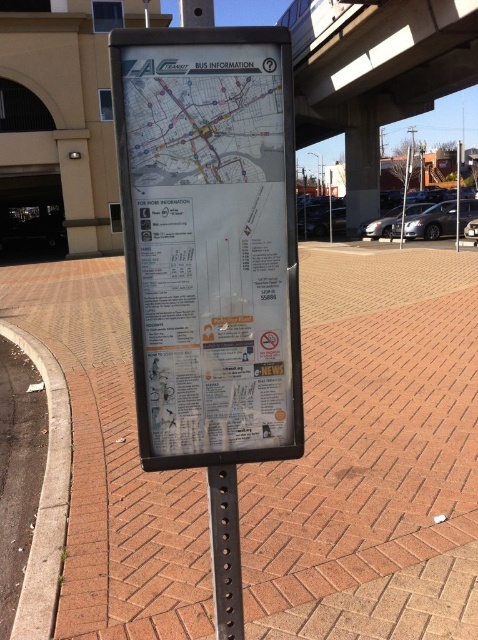
You are standing at the transit station and want to check the bus routes. You see the brick pavement at center and the white plastic map at center. Which object is closer to you?

The brick pavement at center is closer to you because the white plastic map at center is behind it.

You are standing in front of the bus information sign. You want to take a photo of the brick pavement at center without the black metal pole at center appearing in the frame. Is it possible to do so by moving sideways along the pavement?

The black metal pole at center is behind the brick pavement at center, so you can move sideways along the pavement to position yourself where the pole is out of the camera frame while still capturing the brick pavement at center.

You are standing in front of the bus information sign and want to touch both the white plastic map at center and the black metal pole at center. Which object will you need to reach out further to touch?

The black metal pole at center is behind the white plastic map at center, so you will need to reach further to touch the black metal pole at center.